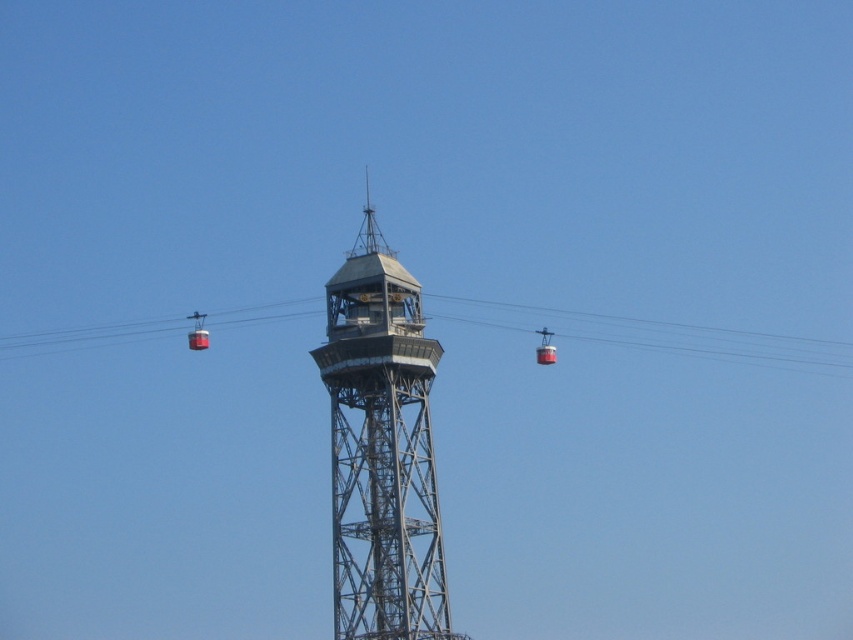
Does metallic gray tower at center have a greater width compared to metallic cable car at center?

In fact, metallic gray tower at center might be narrower than metallic cable car at center.

Can you confirm if metallic gray tower at center is smaller than metallic cable car at center?

No, metallic gray tower at center is not smaller than metallic cable car at center.

The image size is (853, 640). Identify the location of metallic gray tower at center. (381, 449).

Who is lower down, metallic gray tower at center or metallic red cable car at right?

metallic gray tower at center is lower down.

Does metallic gray tower at center have a larger size compared to metallic red cable car at right?

Correct, metallic gray tower at center is larger in size than metallic red cable car at right.

Identify the location of metallic gray tower at center. (381, 449).

Which is below, metallic cable car at center or metallic red cable car at right?

Positioned lower is metallic red cable car at right.

Who is more forward, (840, 348) or (543, 356)?

Positioned in front is point (543, 356).

This screenshot has height=640, width=853. Describe the element at coordinates (662, 333) in the screenshot. I see `metallic cable car at center` at that location.

The height and width of the screenshot is (640, 853). Find the location of `metallic cable car at center`. metallic cable car at center is located at coordinates (662, 333).